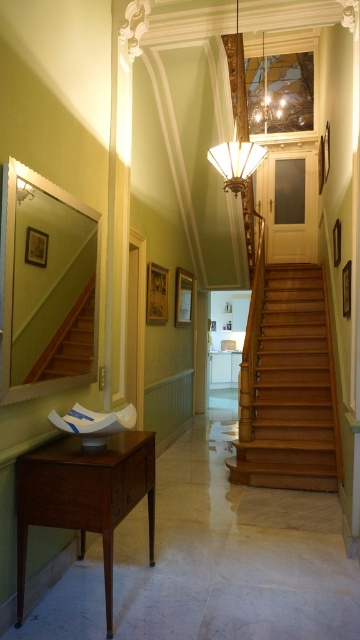
Question: Among these points, which one is farthest from the camera?

Choices:
 (A) (277, 100)
 (B) (280, 301)
 (C) (239, 172)
 (D) (41, 365)

Answer: (A)

Question: Is wooden stairs at left to the right of matte glass lampshade at center from the viewer's perspective?

Choices:
 (A) no
 (B) yes

Answer: (A)

Question: Which point is farther to the camera?

Choices:
 (A) wooden stairs at left
 (B) light brown wooden stairs at center

Answer: (B)

Question: Which object is positioned closest to the matte glass lampshade at center?

Choices:
 (A) metallic glass chandelier at upper center
 (B) wooden stairs at left
 (C) light brown wooden stairs at center

Answer: (B)

Question: Is wooden stairs at left wider than matte glass lampshade at center?

Choices:
 (A) yes
 (B) no

Answer: (B)

Question: Is the position of metallic glass chandelier at upper center more distant than that of matte glass lampshade at center?

Choices:
 (A) yes
 (B) no

Answer: (A)